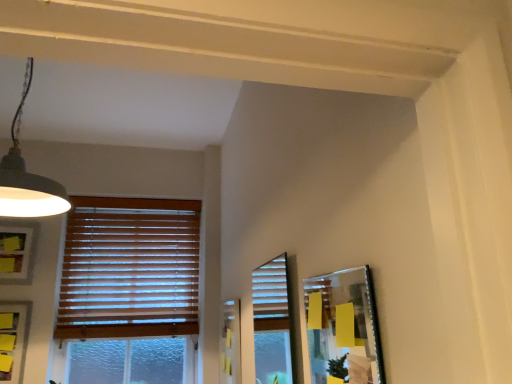
Question: Should I look upward or downward to see metallic silver picture frame at right, which is the 3th picture frame in back-to-front order?

Choices:
 (A) down
 (B) up

Answer: (A)

Question: From a real-world perspective, does metallic silver picture frame at right, marked as the first picture frame in a front-to-back arrangement, stand above matte gray picture frame at lower left, which is the second picture frame from back to front?

Choices:
 (A) no
 (B) yes

Answer: (B)

Question: Does metallic silver picture frame at right, marked as the first picture frame in a front-to-back arrangement, have a lesser height compared to matte gray picture frame at lower left, acting as the second picture frame starting from the front?

Choices:
 (A) no
 (B) yes

Answer: (B)

Question: Considering the relative positions of metallic silver picture frame at right, marked as the first picture frame in a front-to-back arrangement, and matte gray picture frame at lower left, which appears as the second picture frame when viewed from the right, in the image provided, is metallic silver picture frame at right, marked as the first picture frame in a front-to-back arrangement, to the left of matte gray picture frame at lower left, which appears as the second picture frame when viewed from the right, from the viewer's perspective?

Choices:
 (A) yes
 (B) no

Answer: (B)

Question: Does metallic silver picture frame at right, arranged as the 1th picture frame when viewed from the right, come behind matte gray picture frame at lower left, which appears as the second picture frame when viewed from the right?

Choices:
 (A) yes
 (B) no

Answer: (B)

Question: Is metallic silver picture frame at right, arranged as the 1th picture frame when viewed from the right, facing towards matte gray picture frame at lower left, acting as the second picture frame starting from the front?

Choices:
 (A) no
 (B) yes

Answer: (A)

Question: Is metallic silver picture frame at right, marked as the first picture frame in a front-to-back arrangement, with matte gray picture frame at lower left, acting as the second picture frame starting from the front?

Choices:
 (A) no
 (B) yes

Answer: (A)

Question: Does matte black lampshade at upper left lie in front of metallic silver picture frame at right, which is the 3th picture frame in back-to-front order?

Choices:
 (A) yes
 (B) no

Answer: (B)

Question: Is matte black lampshade at upper left bigger than metallic silver picture frame at right, arranged as the 1th picture frame when viewed from the right?

Choices:
 (A) yes
 (B) no

Answer: (A)

Question: From the image's perspective, is matte black lampshade at upper left below metallic silver picture frame at right, placed as the 3th picture frame when sorted from left to right?

Choices:
 (A) no
 (B) yes

Answer: (A)

Question: Considering the relative sizes of matte black lampshade at upper left and metallic silver picture frame at right, marked as the first picture frame in a front-to-back arrangement, in the image provided, is matte black lampshade at upper left thinner than metallic silver picture frame at right, marked as the first picture frame in a front-to-back arrangement,?

Choices:
 (A) no
 (B) yes

Answer: (A)

Question: Does matte black lampshade at upper left touch metallic silver picture frame at right, arranged as the 1th picture frame when viewed from the right?

Choices:
 (A) yes
 (B) no

Answer: (B)

Question: Considering the relative sizes of matte black lampshade at upper left and metallic silver picture frame at right, which is the 3th picture frame in back-to-front order, in the image provided, is matte black lampshade at upper left smaller than metallic silver picture frame at right, which is the 3th picture frame in back-to-front order,?

Choices:
 (A) no
 (B) yes

Answer: (A)

Question: Is matte black lampshade at upper left completely or partially inside wooden blinds at left?

Choices:
 (A) no
 (B) yes

Answer: (A)